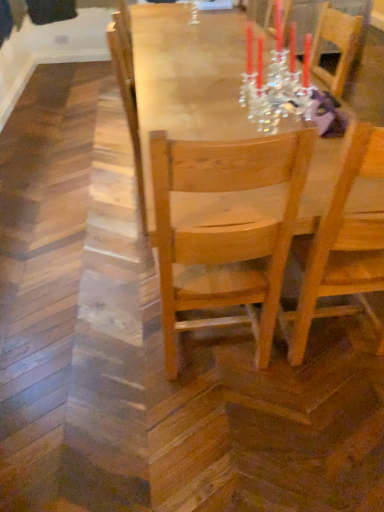
Question: Considering the positions of wooden chair at center, the first chair from the right, and wooden table at center in the image, is wooden chair at center, the first chair from the right, wider or thinner than wooden table at center?

Choices:
 (A) wide
 (B) thin

Answer: (B)

Question: Is wooden chair at center, the second chair when ordered from left to right, inside the boundaries of wooden table at center, or outside?

Choices:
 (A) inside
 (B) outside

Answer: (A)

Question: Considering the real-world distances, which object is farthest from the light wood chair at center, positioned as the 1th chair in left-to-right order?

Choices:
 (A) wooden chair at center, the second chair when ordered from left to right
 (B) wooden table at center

Answer: (B)

Question: Estimate the real-world distances between objects in this image. Which object is farther from the wooden chair at center, the first chair from the right?

Choices:
 (A) light wood chair at center, positioned as the 1th chair in left-to-right order
 (B) wooden table at center

Answer: (B)